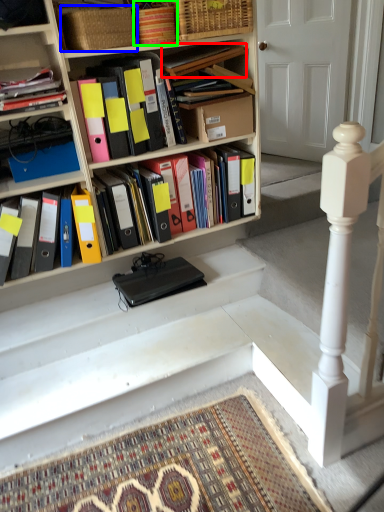
Question: Which object is the closest to the book (highlighted by a red box)? Choose among these: basket (highlighted by a blue box) or crate (highlighted by a green box).

Choices:
 (A) basket
 (B) crate

Answer: (B)